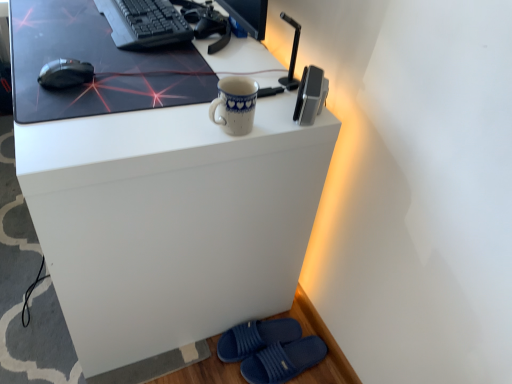
The width and height of the screenshot is (512, 384). Identify the location of unoccupied space behind satin silver speaker at upper right. (280, 69).